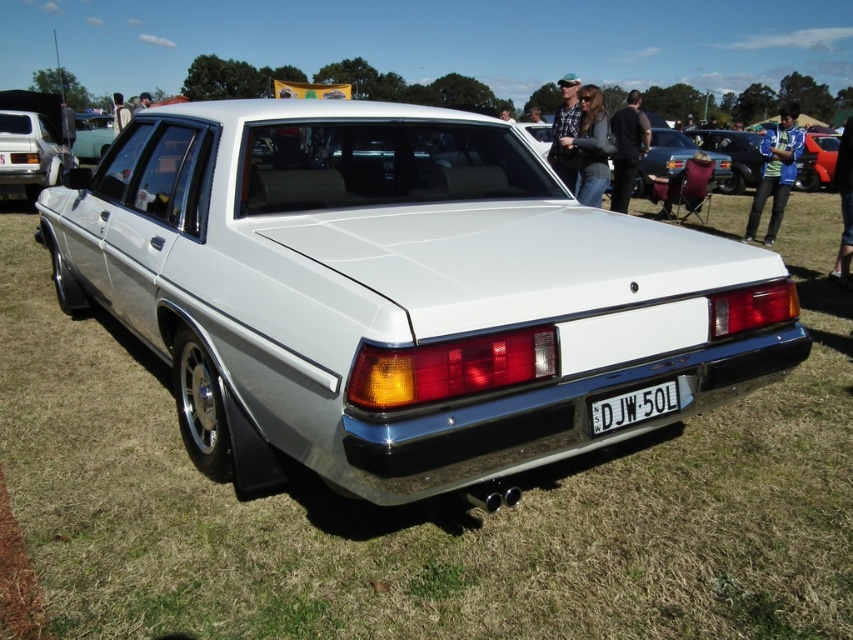
You are a photographer trying to capture the white glossy sedan at center and the black plastic license plate at center in a single frame. Which object will appear bigger in the photo?

The white glossy sedan at center will appear bigger in the photo because it has a larger size compared to the black plastic license plate at center.

You are a parking attendant at an outdoor car show. You need to park a new car between the white glossy sedan at center and the matte white sedan at left. The new car is 1.8 meters wide. Can you fit it between them without touching either car?

The white glossy sedan at center might be wider than matte white sedan at left, so there is insufficient information to determine if the space between them can accommodate the new car of 1.8 meters width.